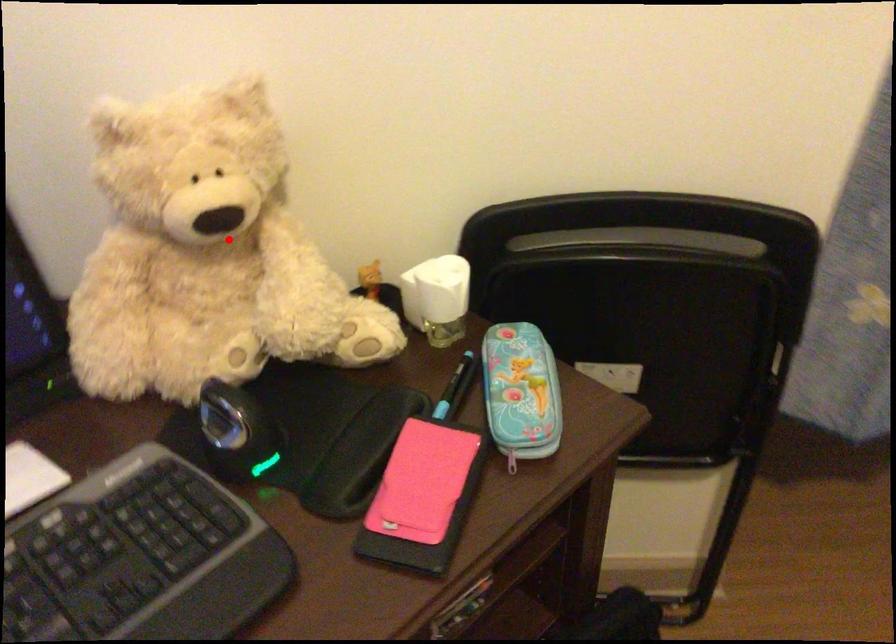
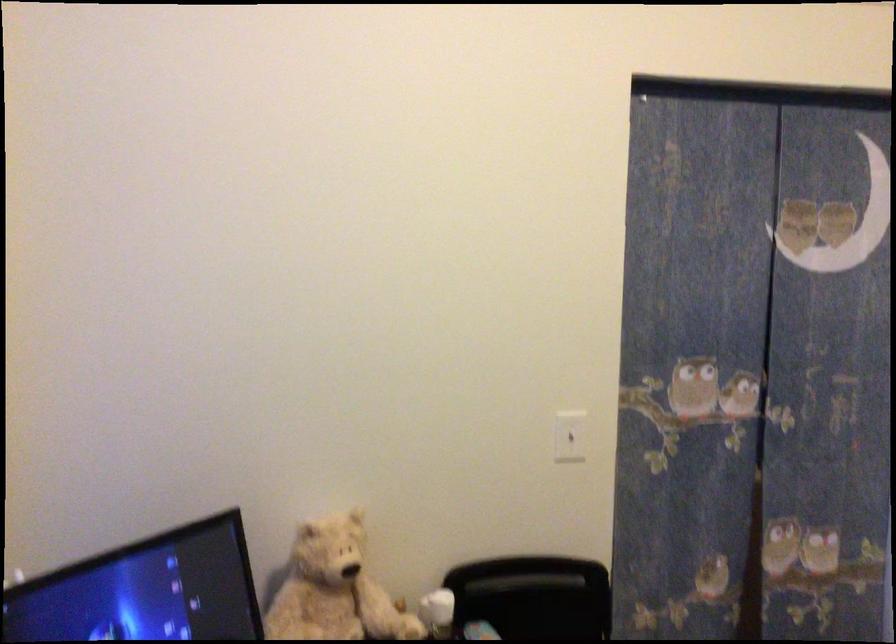
Locate, in the second image, the point that corresponds to the highlighted location in the first image.

(334, 589)